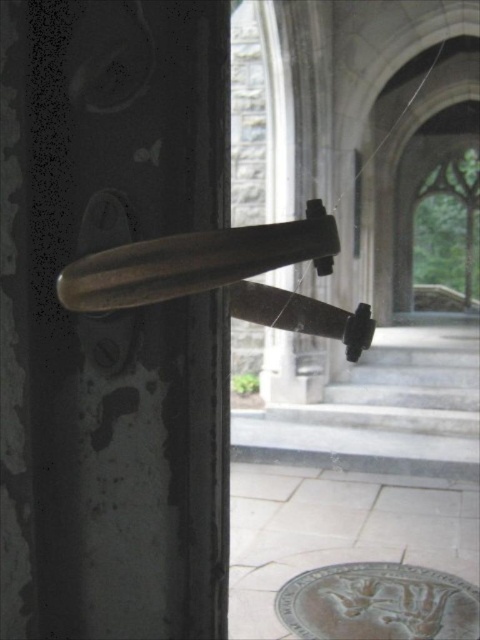
Question: Which object appears closest to the camera in this image?

Choices:
 (A) polished brass handle at left
 (B) bronze textured medallion at lower center
 (C) polished brass door handle at center

Answer: (C)

Question: In this image, where is polished brass handle at left located relative to bronze textured medallion at lower center?

Choices:
 (A) below
 (B) above

Answer: (B)

Question: Is polished brass handle at left further to camera compared to polished brass door handle at center?

Choices:
 (A) no
 (B) yes

Answer: (B)

Question: Among these points, which one is farthest from the camera?

Choices:
 (A) (49, 109)
 (B) (328, 595)

Answer: (B)

Question: Does polished brass door handle at center have a smaller size compared to bronze textured medallion at lower center?

Choices:
 (A) no
 (B) yes

Answer: (A)

Question: Which point is farther to the camera?

Choices:
 (A) polished brass door handle at center
 (B) polished brass handle at left
 (C) bronze textured medallion at lower center

Answer: (C)